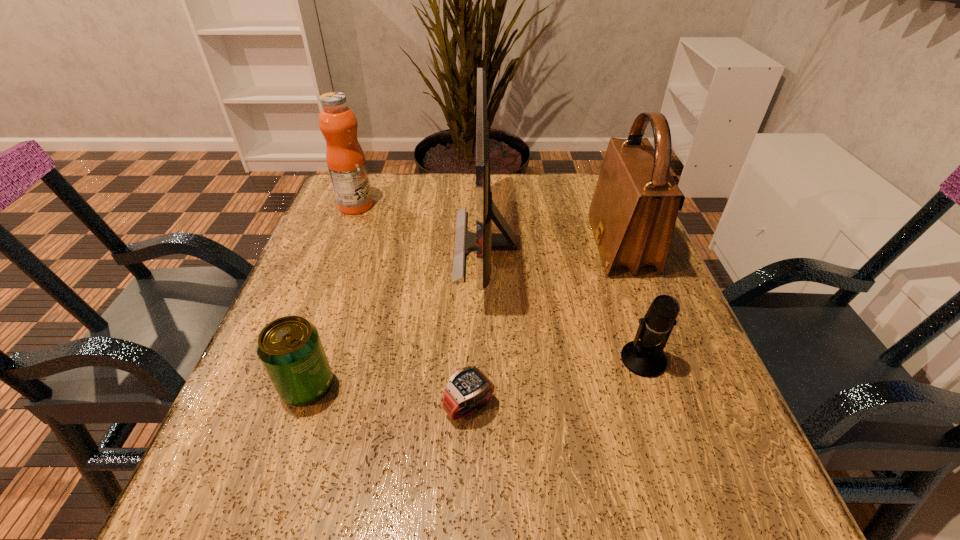
At what (x,y) coordinates should I click in order to perform the action: click on object that is the fifth closest to the monitor. Please return your answer as a coordinate pair (x, y). The width and height of the screenshot is (960, 540). Looking at the image, I should click on (290, 349).

This screenshot has height=540, width=960. I want to click on object that is the closest to the fruit juice, so click(x=483, y=241).

Identify the location of vacant point that satisfies the following two spatial constraints: 1. on the front flap of the shoulder bag; 2. on the front side of the beer can. (675, 387).

Identify the location of vacant region that satisfies the following two spatial constraints: 1. on the screen side of the monitor; 2. on the left side of the microphone. This screenshot has width=960, height=540. point(488,360).